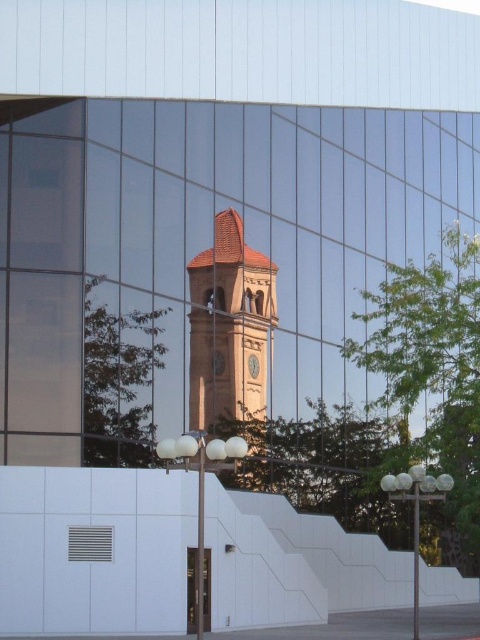
Question: Which point appears farthest from the camera in this image?

Choices:
 (A) (206, 604)
 (B) (118, 323)
 (C) (96, 525)
 (D) (237, 268)

Answer: (D)

Question: Which point is farther to the camera?

Choices:
 (A) (467, 449)
 (B) (187, 620)

Answer: (A)

Question: Estimate the real-world distances between objects in this image. Which object is closer to the transparent glass door at lower center?

Choices:
 (A) green leafy tree at right
 (B) green leafy tree at center
 (C) metallic grid at lower left

Answer: (C)

Question: Can you confirm if brown textured clock tower at center is positioned below green leafy tree at center?

Choices:
 (A) no
 (B) yes

Answer: (A)

Question: Does green leafy tree at right lie behind transparent glass door at lower center?

Choices:
 (A) no
 (B) yes

Answer: (B)

Question: Can you confirm if brown textured clock tower at center is positioned above green leafy tree at center?

Choices:
 (A) yes
 (B) no

Answer: (A)